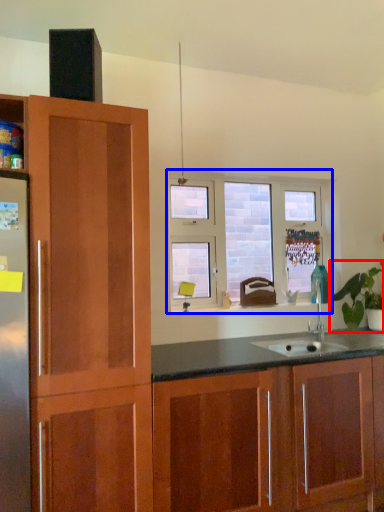
Question: Among these objects, which one is nearest to the camera, houseplant (highlighted by a red box) or window (highlighted by a blue box)?

Choices:
 (A) houseplant
 (B) window

Answer: (A)